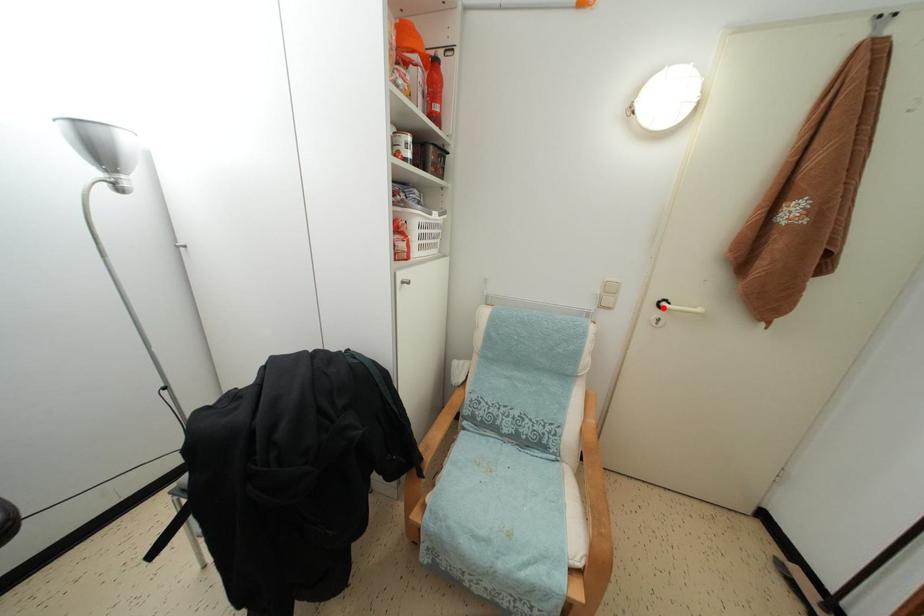
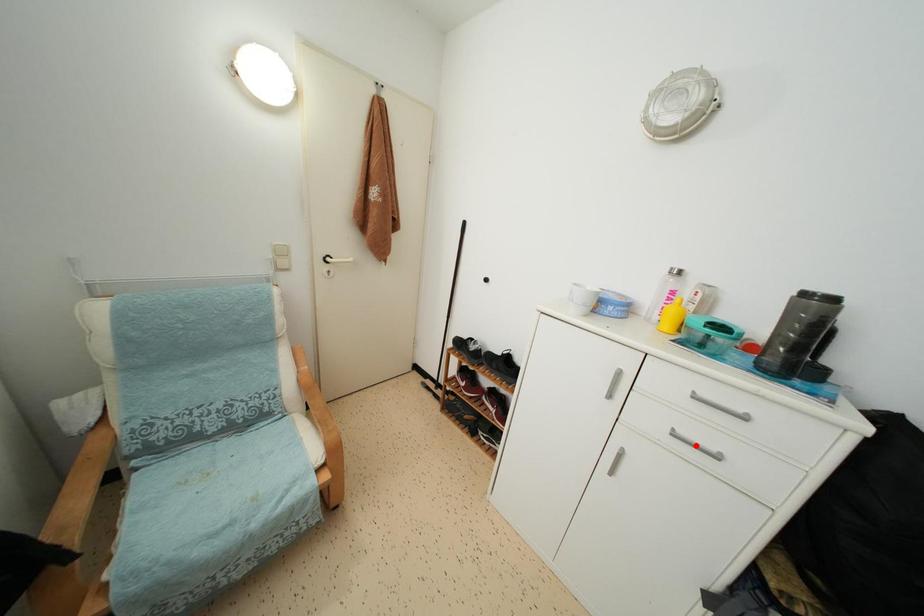
I am providing you with two images of the same scene from different viewpoints. A red point is marked on the first image and another point is marked on the second image. Is the red point in image1 aligned with the point shown in image2?

No